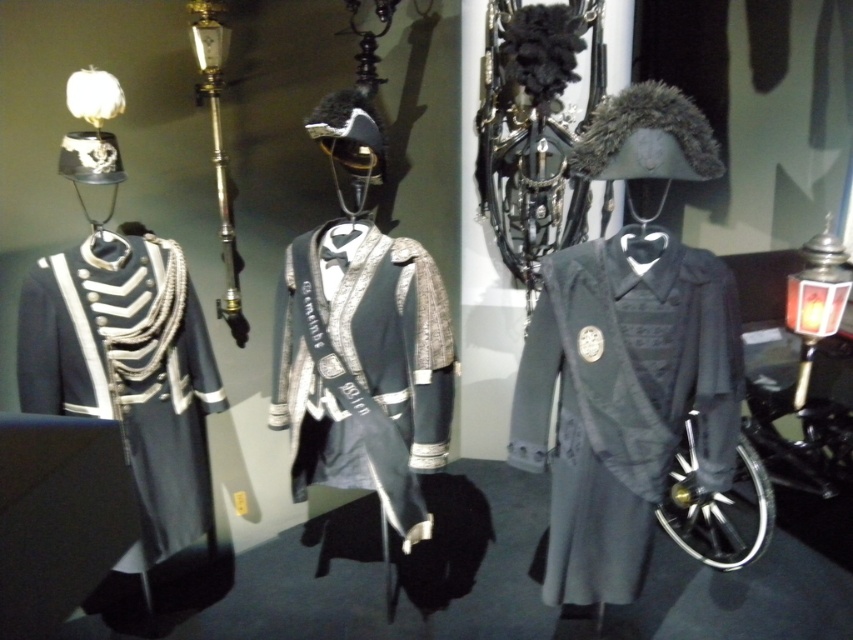
You are a visitor to the museum and want to take a photo of the shiny silver jacket at center without the matte black coat at center blocking it. Is this possible given their current positions?

The matte black coat at center is in front of the shiny silver jacket at center, so it is blocking the view. To take a photo of the shiny silver jacket at center without the matte black coat at center blocking it, you would need to move around the display to find an angle where the shiny silver jacket at center is visible without the matte black coat at center in front of it.

You are a visitor standing in front of the historical military uniforms exhibit. You notice two points marked in the display. Which of the two points, point (718,397) or point (340,424), is closer to your viewpoint?

Point (718,397) is closer to the camera than point (340,424), so the point closer to your viewpoint is point (718,397).

You are a museum visitor standing in front of the display. You see two jackets displayed at the center of the exhibit. The matte black coat at center and the shiny silver jacket at center. Which one is positioned to the right?

The matte black coat at center is positioned to the right of the shiny silver jacket at center.